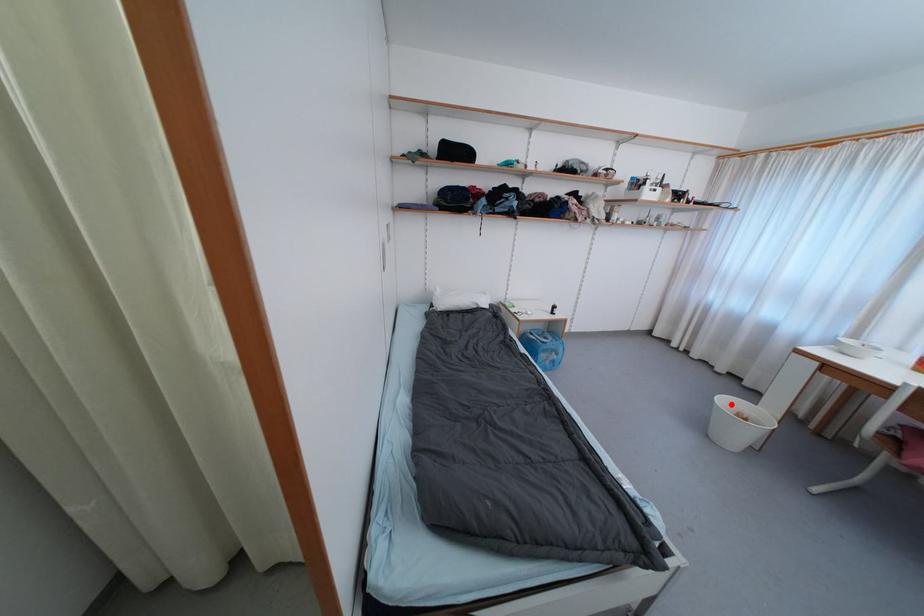
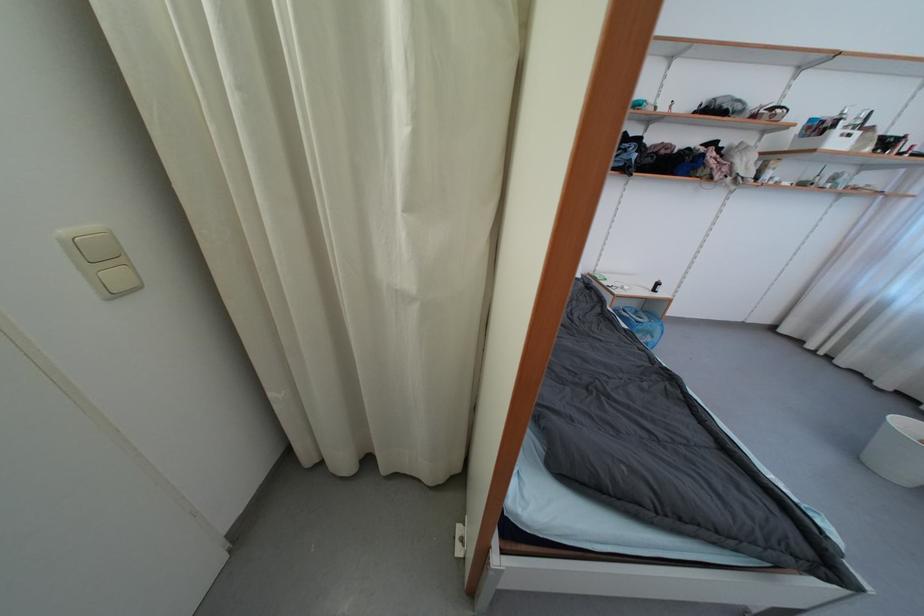
Question: I am providing you with two images of the same scene from different viewpoints. A red point is shown in image1. For the corresponding object point in image2, is it positioned nearer or farther from the camera?

Choices:
 (A) Nearer
 (B) Farther

Answer: (B)